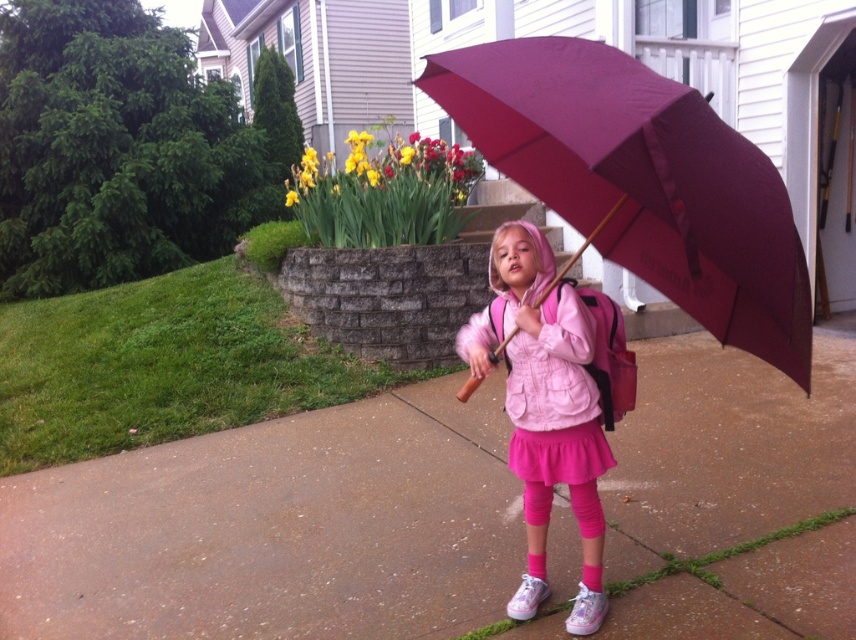
You are a delivery robot with a height of 1.5 meters. You need to deliver a package to the front door of the house shown in the image. The path to the door is through the smooth concrete pavement at center and the burgundy fabric umbrella at center. Can you safely pass between them without hitting your head?

The distance between the smooth concrete pavement at center and the burgundy fabric umbrella at center is 1.74 meters. Since the robot is 1.5 meters tall, it can safely pass through the space between them without hitting its head.

What is located at the point with coordinates (275, 529) in the image?

The smooth concrete pavement at center is located at point (275, 529).